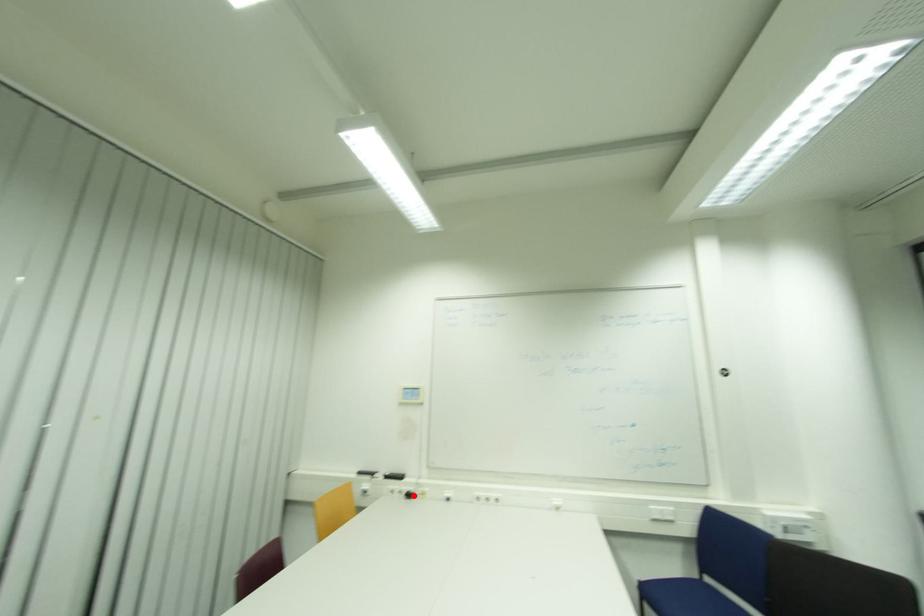
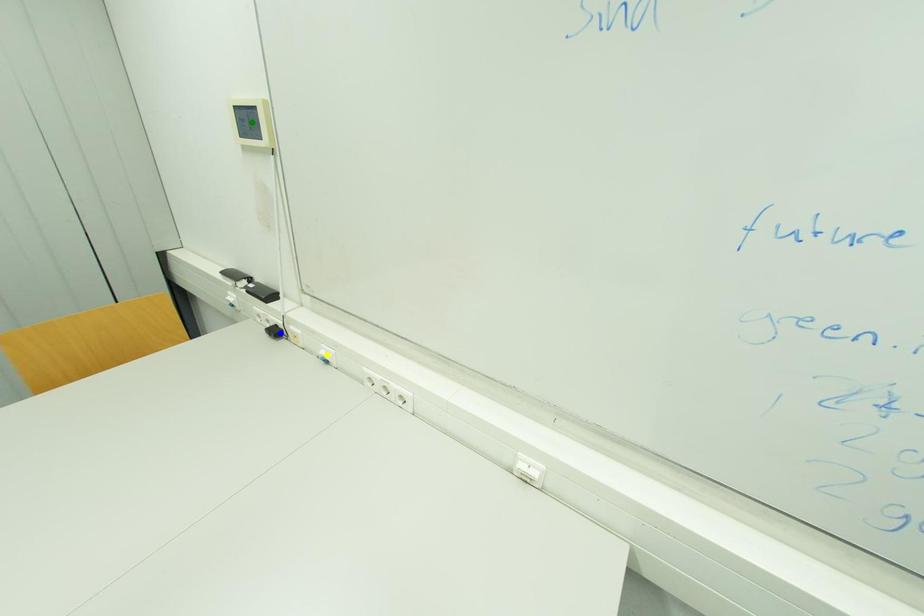
Question: I am providing you with two images of the same scene from different viewpoints. A red point is marked on the first image. You are given multiple points on the second image. Which mark in image 2 goes with the point in image 1?

Choices:
 (A) yellow point
 (B) blue point
 (C) green point

Answer: (B)